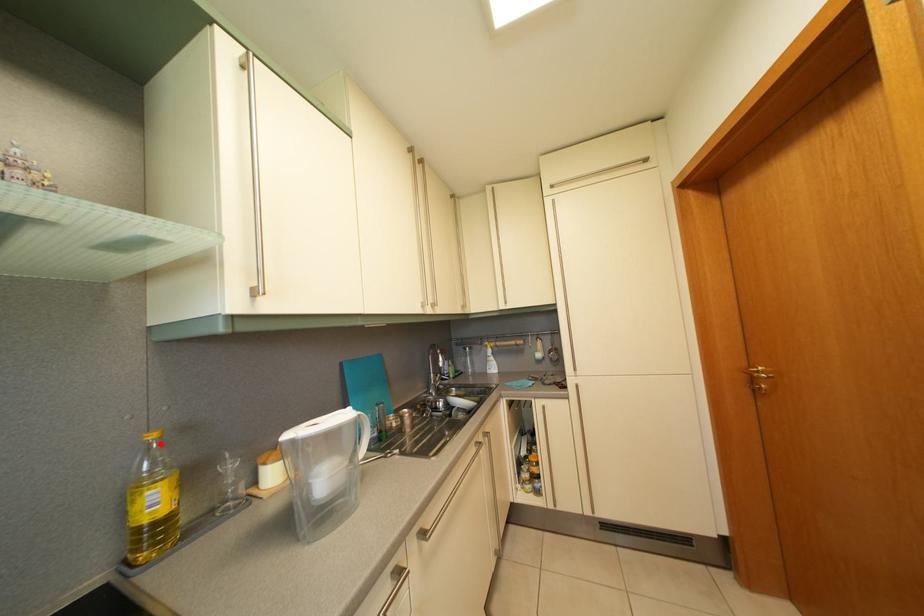
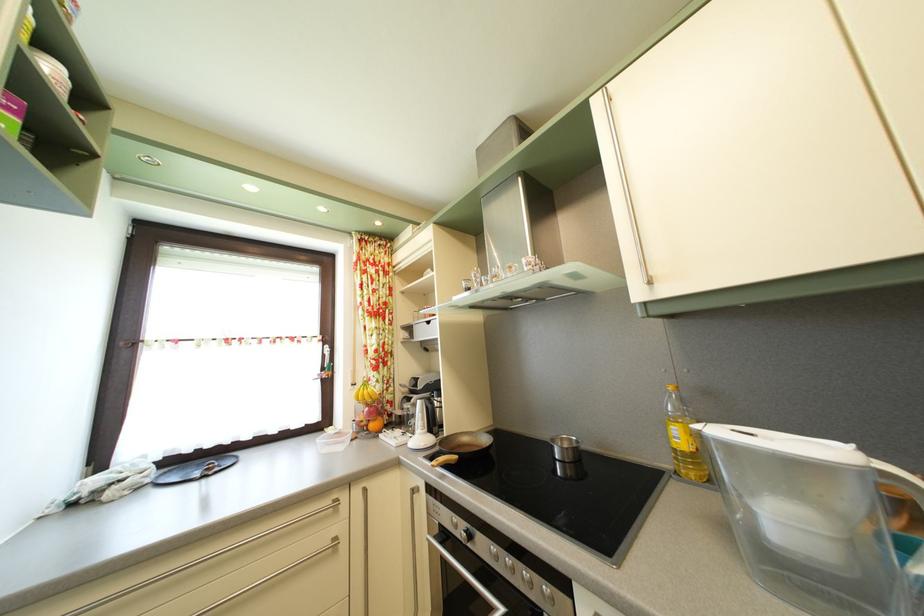
The point at the highlighted location is marked in the first image. Where is the corresponding point in the second image?

(678, 395)